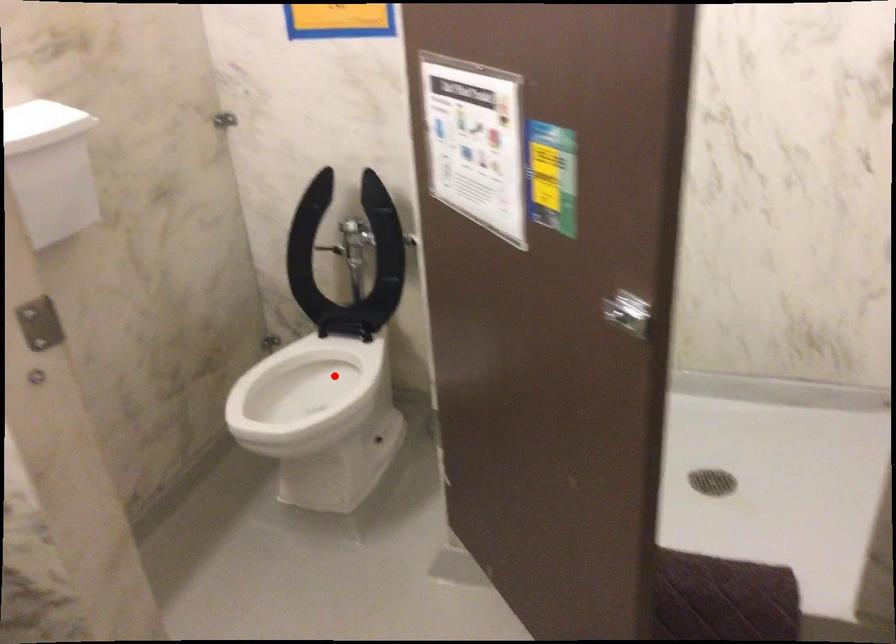
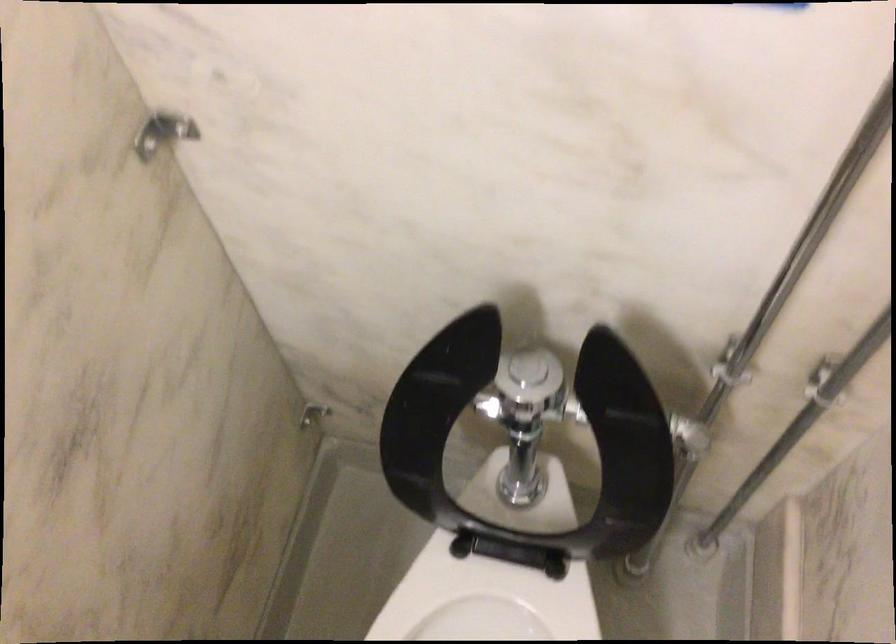
Question: I am providing you with two images of the same scene from different viewpoints. Image1 has a red point marked. In image2, the corresponding 3D location appears at what relative position? Reply with the corresponding letter.

Choices:
 (A) Closer
 (B) Farther

Answer: (A)